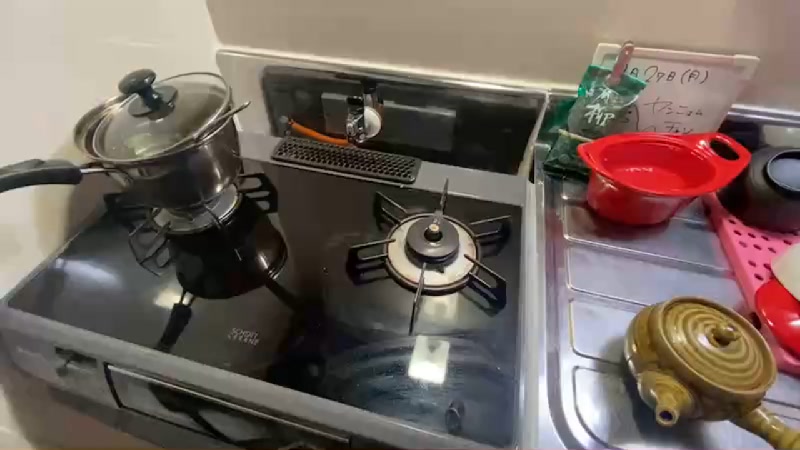
The width and height of the screenshot is (800, 450). I want to click on silver sauce pan on burner, so click(186, 169).